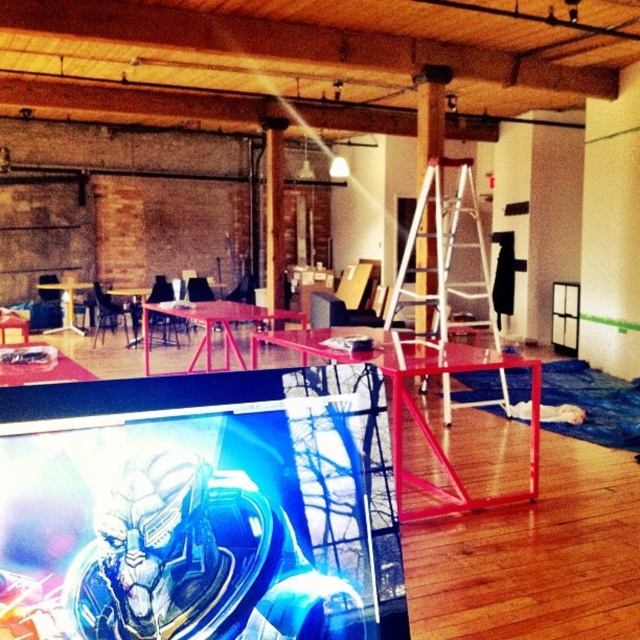
Does white metal ladder at center have a lesser height compared to white glossy pillar at center?

No.

What do you see at coordinates (445, 257) in the screenshot? The image size is (640, 640). I see `white metal ladder at center` at bounding box center [445, 257].

In order to click on white metal ladder at center in this screenshot , I will do `click(445, 257)`.